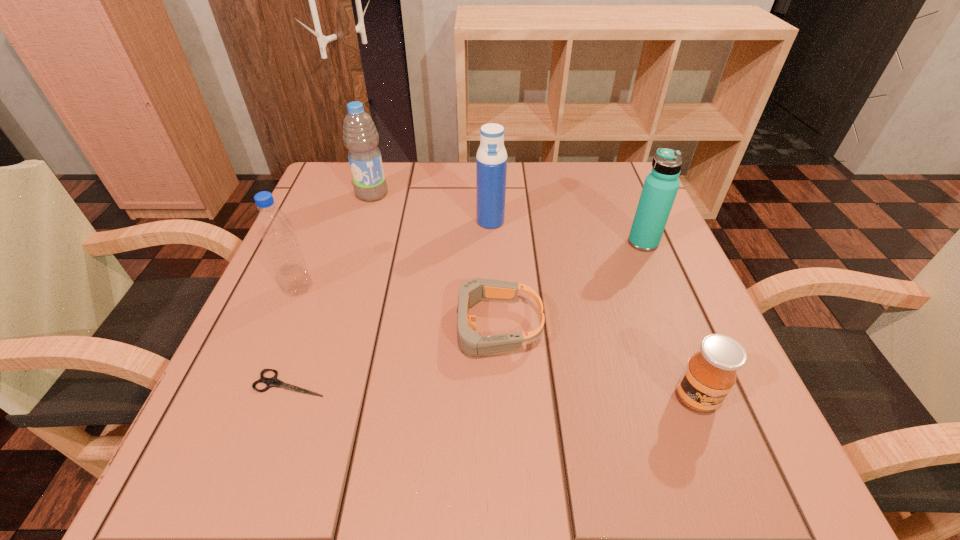
Locate an element on the screen. The width and height of the screenshot is (960, 540). vacant area between the goggles and the second farthest object is located at coordinates (492, 273).

This screenshot has width=960, height=540. What are the coordinates of `unoccupied area between the third farthest water bottle and the farthest water bottle` in the screenshot? It's located at point(508,218).

In order to click on vacant region between the second shortest object and the leftmost water bottle in this screenshot , I will do `click(396, 307)`.

Locate an element on the screen. This screenshot has width=960, height=540. free area in between the rightmost water bottle and the honey is located at coordinates (669, 320).

Where is `free space between the second farthest object and the shortest object`? free space between the second farthest object and the shortest object is located at coordinates tap(391, 302).

This screenshot has width=960, height=540. I want to click on vacant space in between the sixth tallest object and the shortest object, so click(x=392, y=354).

Image resolution: width=960 pixels, height=540 pixels. In order to click on vacant region between the farthest object and the leftmost water bottle in this screenshot , I will do `click(335, 241)`.

At what (x,y) coordinates should I click in order to perform the action: click on free space between the goggles and the nearest water bottle. Please return your answer as a coordinate pair (x, y). Looking at the image, I should click on (396, 307).

Identify which object is the second closest to the farthest object. Please provide its 2D coordinates. Your answer should be formatted as a tuple, i.e. [(x, y)], where the tuple contains the x and y coordinates of a point satisfying the conditions above.

[(274, 227)]

This screenshot has width=960, height=540. Identify the location of object that ranks as the closest to the farthest water bottle. (491, 160).